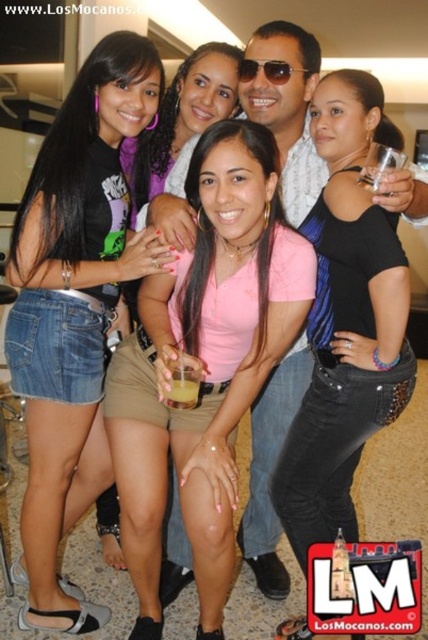
You are a photographer at the event and want to take a closeup of the pink matte shirt at center without including the denim shorts at left. Which direction should you pan the camera?

The denim shorts at left is positioned on the left side of pink matte shirt at center, so you should pan the camera to the right to exclude the denim shorts at left and focus on the pink matte shirt at center.

You are a photographer trying to capture a clear shot of the black shiny tank top at center and the sunglasses at center. Which object is closer to the camera?

The black shiny tank top at center is in front of the sunglasses at center, so it is closer to the camera.